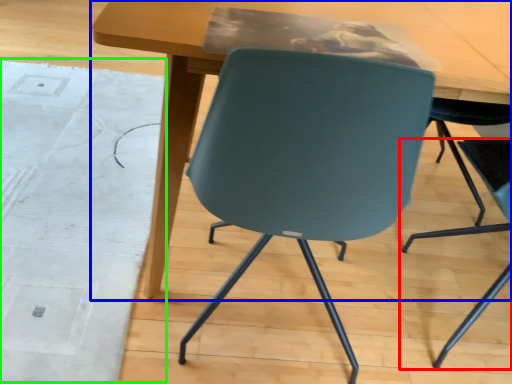
Question: Which object is the farthest from chair (highlighted by a red box)? Choose among these: table (highlighted by a blue box) or mat (highlighted by a green box).

Choices:
 (A) table
 (B) mat

Answer: (B)